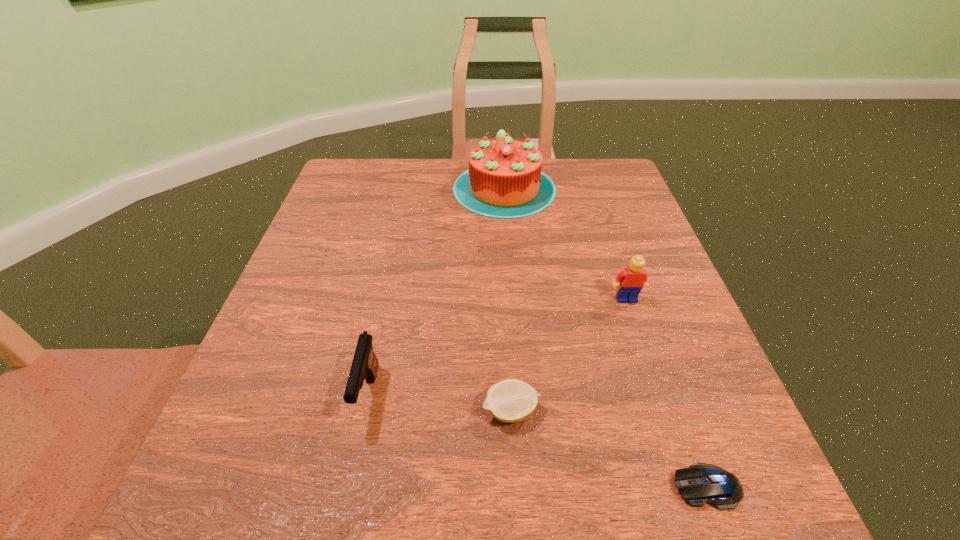
Identify the location of the farthest object. The width and height of the screenshot is (960, 540). (504, 180).

This screenshot has height=540, width=960. I want to click on the tallest object, so click(504, 180).

At what (x,y) coordinates should I click in order to perform the action: click on the second farthest object. Please return your answer as a coordinate pair (x, y). Looking at the image, I should click on (632, 279).

Find the location of a particular element. The height and width of the screenshot is (540, 960). the leftmost object is located at coordinates (365, 364).

The image size is (960, 540). I want to click on the second shortest object, so click(511, 400).

You are a GUI agent. You are given a task and a screenshot of the screen. Output one action in this format:
    pyautogui.click(x=<x>, y=<y>)
    Task: Click on the shortest object
    This screenshot has height=540, width=960.
    Given the screenshot: What is the action you would take?
    pyautogui.click(x=700, y=483)

The width and height of the screenshot is (960, 540). In order to click on computer mouse in this screenshot , I will do `click(700, 483)`.

Image resolution: width=960 pixels, height=540 pixels. In order to click on free region located on the left of the farthest object in this screenshot , I will do `click(362, 188)`.

Where is `free space located on the face of the second farthest object`? This screenshot has height=540, width=960. free space located on the face of the second farthest object is located at coordinates (650, 368).

In order to click on vacant space positioned 0.130m at the barrel of the pistol in this screenshot , I will do `click(341, 525)`.